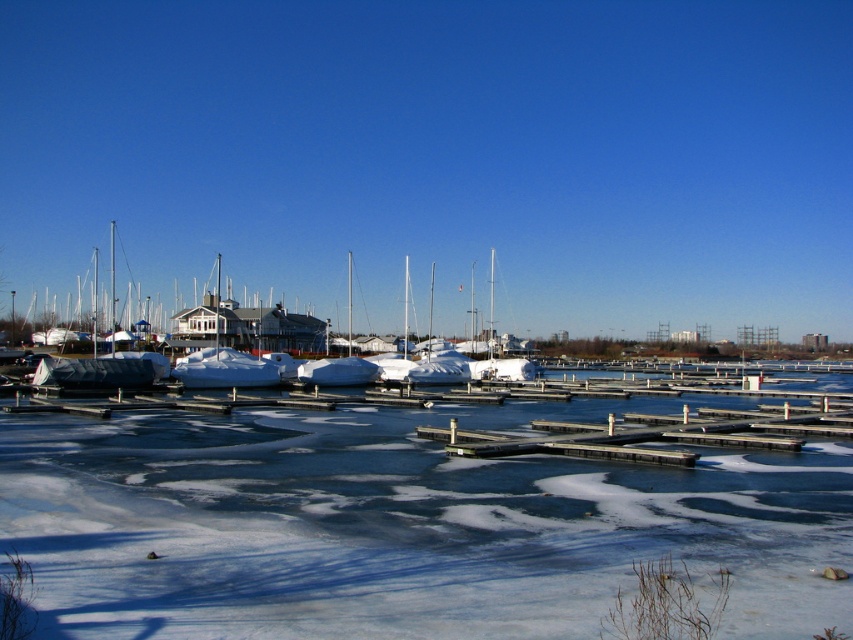
Looking at this image, you are standing at the edge of the frozen marina and see the white ice at lower center and the white matte boat at center. Which object is closer to your feet?

The white ice at lower center is closer to your feet since it is positioned below the white matte boat at center.

You are an ice safety inspector checking the marina. The white ice at lower center must support the weight of the white matte boat at center. Based on the scene, can the ice safely hold the boat?

The white ice at lower center occupies less space than the white matte boat at center, so it may not provide sufficient surface area to safely support the boat. The boat should be moved to a larger ice area.